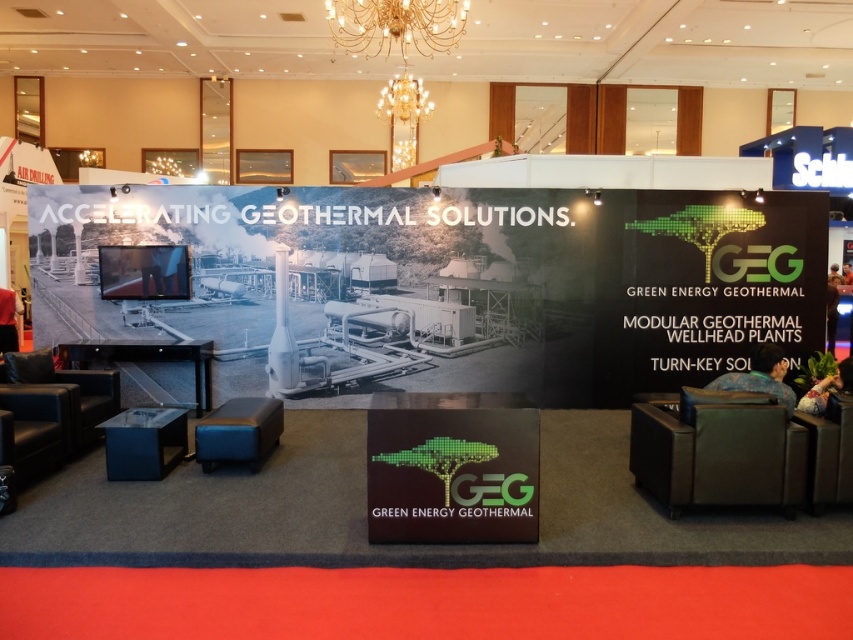
Can you confirm if green floral dress at center is bigger than brown leather jacket at center?

No, green floral dress at center is not bigger than brown leather jacket at center.

Can you confirm if green floral dress at center is smaller than brown leather jacket at center?

Yes, green floral dress at center is smaller than brown leather jacket at center.

This screenshot has height=640, width=853. In order to click on green floral dress at center in this screenshot , I will do `click(827, 388)`.

Can you confirm if leather armchair at lower left is positioned above gold metallic chandelier at upper center?

Actually, leather armchair at lower left is below gold metallic chandelier at upper center.

Is leather armchair at lower left to the left of gold metallic chandelier at upper center from the viewer's perspective?

Yes, leather armchair at lower left is to the left of gold metallic chandelier at upper center.

Find the location of a particular element. leather armchair at lower left is located at coordinates (68, 390).

Locate an element on the screen. The height and width of the screenshot is (640, 853). leather armchair at lower left is located at coordinates (68, 390).

Is black leather armchair at lower left to the left of green fabric chair at lower right from the viewer's perspective?

Correct, you'll find black leather armchair at lower left to the left of green fabric chair at lower right.

Does black leather armchair at lower left appear over green fabric chair at lower right?

Actually, black leather armchair at lower left is below green fabric chair at lower right.

Between point (38, 456) and point (779, 355), which one is positioned behind?

The point (779, 355) is behind.

The width and height of the screenshot is (853, 640). I want to click on black leather armchair at lower left, so click(x=33, y=428).